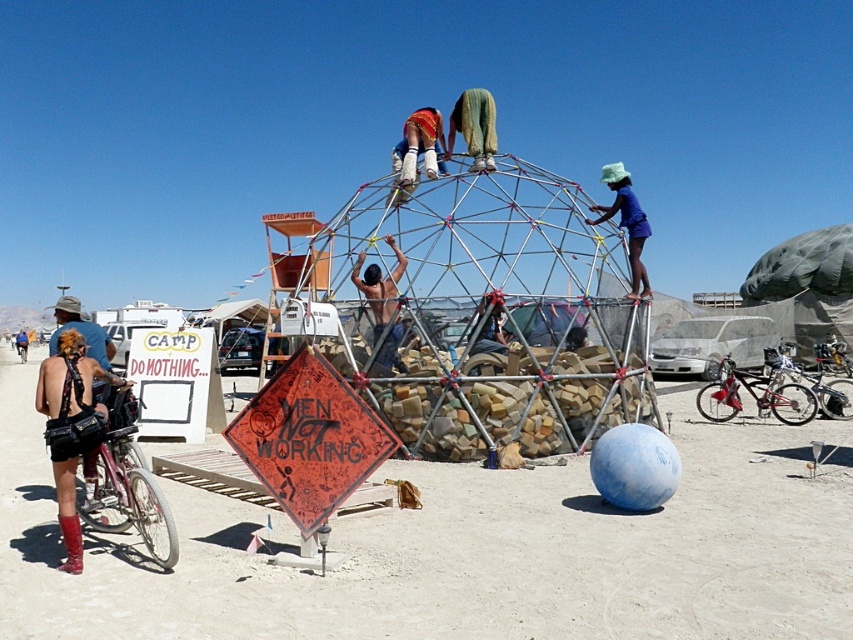
Question: Does leather black purse at lower left have a greater width compared to reddish-orange fabric pants at upper center?

Choices:
 (A) no
 (B) yes

Answer: (A)

Question: Can you confirm if shiny red bicycle at lower right is bigger than reddish-orange fabric pants at upper center?

Choices:
 (A) yes
 (B) no

Answer: (B)

Question: Estimate the real-world distances between objects in this image. Which object is closer to the smooth wooden pole at center?

Choices:
 (A) shiny red bicycle at lower right
 (B) matte black bicycle at lower left

Answer: (A)

Question: Based on their relative distances, which object is nearer to the reddish-orange fabric pants at upper center?

Choices:
 (A) shiny red bicycle at lower right
 (B) orange reflective diamond at center
 (C) matte black bicycle at lower left

Answer: (B)

Question: Which object is the farthest from the shiny red bicycle at lower right?

Choices:
 (A) blue fabric hat at upper center
 (B) matte black bicycle at lower left
 (C) orange reflective diamond at center

Answer: (B)

Question: Can you confirm if brushed metal bicycle at lower left is wider than reddish-orange fabric pants at upper center?

Choices:
 (A) no
 (B) yes

Answer: (B)